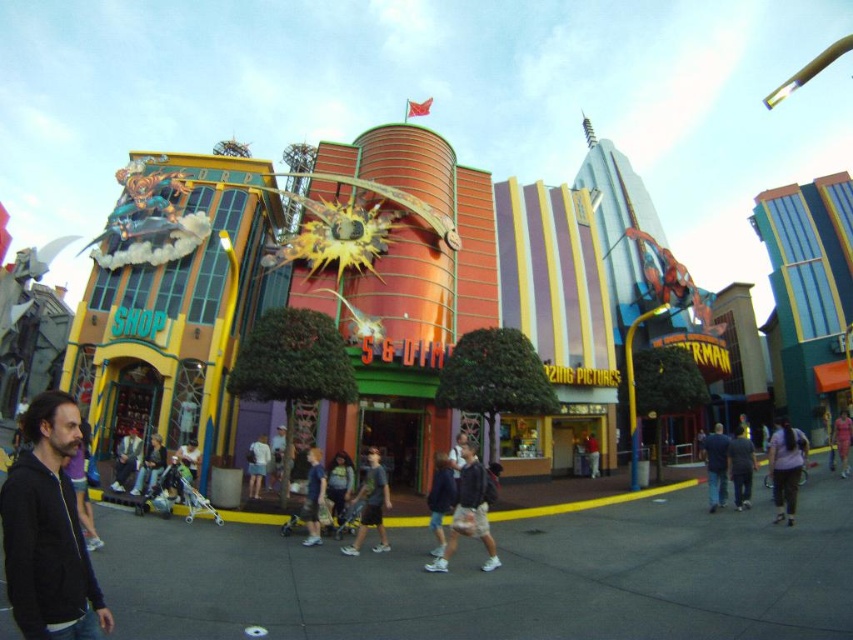
Question: Can you confirm if dark blue fabric at center is smaller than denim jacket at center?

Choices:
 (A) yes
 (B) no

Answer: (B)

Question: Among these points, which one is nearest to the camera?

Choices:
 (A) (26, 412)
 (B) (585, 444)
 (C) (724, 460)
 (D) (259, 444)

Answer: (A)

Question: Which of the following is the closest to the observer?

Choices:
 (A) (769, 442)
 (B) (750, 461)

Answer: (B)

Question: Does light blue denim shorts at center appear under white cotton shirt at lower center?

Choices:
 (A) no
 (B) yes

Answer: (A)

Question: Among these objects, which one is farthest from the camera?

Choices:
 (A) pink fabric dress at center
 (B) dark blue fabric at center

Answer: (A)

Question: Is dark blue jeans at lower right wider than denim jacket at lower left?

Choices:
 (A) no
 (B) yes

Answer: (B)